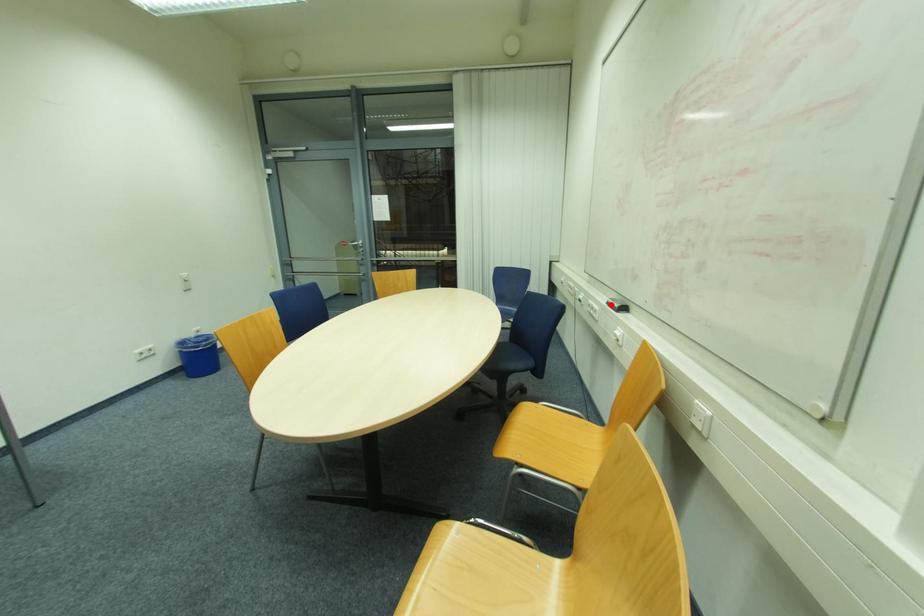
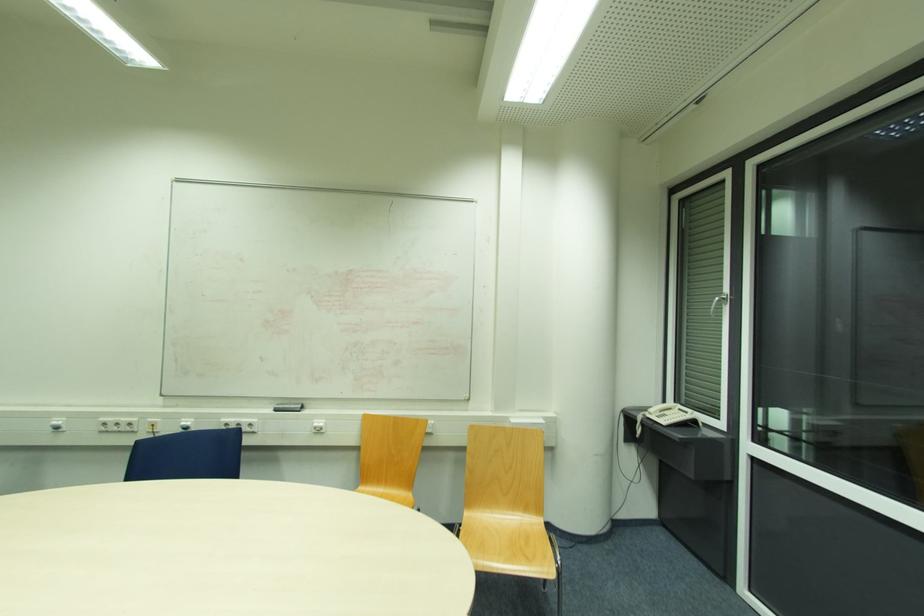
In the second image, find the point that corresponds to the highlighted location in the first image.

(276, 411)